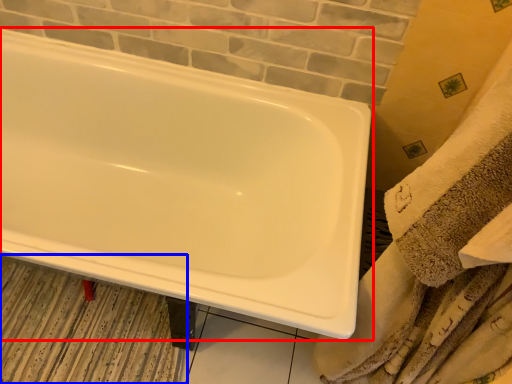
Question: Which of the following is the farthest to the observer, bathtub (highlighted by a red box) or bath mat (highlighted by a blue box)?

Choices:
 (A) bathtub
 (B) bath mat

Answer: (B)